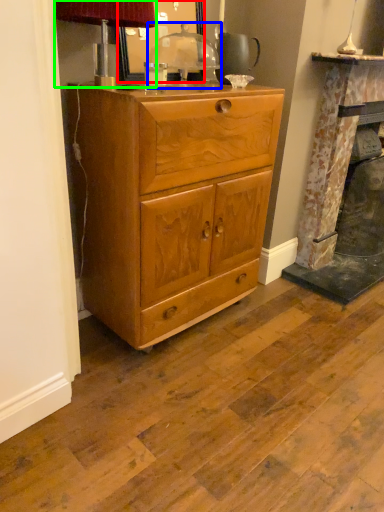
Question: Based on their relative distances, which object is farther from mirror (highlighted by a red box)? Choose from table lamp (highlighted by a blue box) and table lamp (highlighted by a green box).

Choices:
 (A) table lamp
 (B) table lamp

Answer: (B)